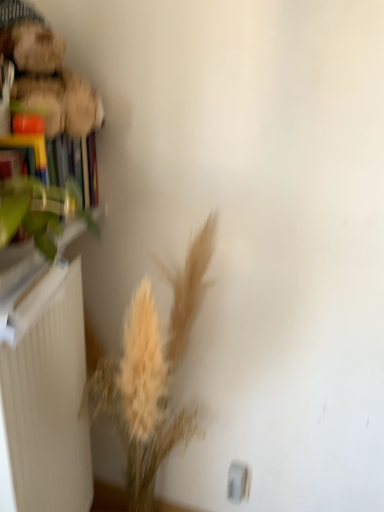
You are a GUI agent. You are given a task and a screenshot of the screen. Output one action in this format:
    pyautogui.click(x=<x>, y=<y>)
    Task: Click on the green leafy plant at left
    This screenshot has width=384, height=512.
    Given the screenshot: What is the action you would take?
    pyautogui.click(x=36, y=211)

Measure the distance between point (9, 140) and camera.

Point (9, 140) and camera are 37.01 inches apart from each other.

Find the location of a particular element. The width and height of the screenshot is (384, 512). green leafy plant at left is located at coordinates (36, 211).

Is white matte radiator at left oriented away from green leafy plant at left?

No, green leafy plant at left is not at the back of white matte radiator at left.

Is white matte radiator at left completely or partially outside of green leafy plant at left?

That's correct, white matte radiator at left is outside of green leafy plant at left.

Locate an element on the screen. plant behind the white matte radiator at left is located at coordinates (36, 211).

From the picture: Based on their sizes in the image, would you say white matte radiator at left is bigger or smaller than green leafy plant at left?

white matte radiator at left is bigger than green leafy plant at left.

Is green leafy plant at left facing away from light beige dried grass at lower left?

No, green leafy plant at left is not facing away from light beige dried grass at lower left.

From the image's perspective, is green leafy plant at left above or below light beige dried grass at lower left?

Based on their image positions, green leafy plant at left is located above light beige dried grass at lower left.

Considering the relative sizes of green leafy plant at left and light beige dried grass at lower left in the image provided, is green leafy plant at left smaller than light beige dried grass at lower left?

Indeed, green leafy plant at left has a smaller size compared to light beige dried grass at lower left.

Between green leafy plant at left and light beige dried grass at lower left, which one appears on the right side from the viewer's perspective?

light beige dried grass at lower left is more to the right.

Considering the sizes of objects hardcover book at left and green leafy plant at left in the image provided, who is bigger, hardcover book at left or green leafy plant at left?

hardcover book at left is bigger.

From the image's perspective, is hardcover book at left above or below green leafy plant at left?

hardcover book at left is above green leafy plant at left.

Based on the photo, how much distance is there between hardcover book at left and green leafy plant at left?

hardcover book at left and green leafy plant at left are 10.26 inches apart from each other.

Is hardcover book at left at the back of light beige dried grass at lower left?

No, light beige dried grass at lower left is not facing away from hardcover book at left.

Are light beige dried grass at lower left and hardcover book at left making contact?

They are not placed beside each other.

Is light beige dried grass at lower left bigger than hardcover book at left?

Correct, light beige dried grass at lower left is larger in size than hardcover book at left.

Considering the sizes of objects light beige dried grass at lower left and hardcover book at left in the image provided, who is taller, light beige dried grass at lower left or hardcover book at left?

Standing taller between the two is light beige dried grass at lower left.

Which is in front, point (66, 162) or point (147, 333)?

The point (147, 333) is more forward.

From a real-world perspective, which is physically below, hardcover book at left or light beige dried grass at lower left?

light beige dried grass at lower left.

Considering the relative sizes of hardcover book at left and light beige dried grass at lower left in the image provided, is hardcover book at left shorter than light beige dried grass at lower left?

Yes, hardcover book at left is shorter than light beige dried grass at lower left.

Looking at this image, which of these two, green leafy plant at left or hardcover book at left, is bigger?

With larger size is hardcover book at left.

From the image's perspective, which is above, green leafy plant at left or hardcover book at left?

From the image's view, hardcover book at left is above.

Which object is positioned more to the left, green leafy plant at left or hardcover book at left?

Positioned to the left is green leafy plant at left.

Which object is wider, white matte radiator at left or hardcover book at left?

Wider between the two is white matte radiator at left.

Who is smaller, white matte radiator at left or hardcover book at left?

hardcover book at left is smaller.

From a real-world perspective, is white matte radiator at left under hardcover book at left?

Yes, from a real-world perspective, white matte radiator at left is beneath hardcover book at left.

How different are the orientations of white matte radiator at left and hardcover book at left in degrees?

The facing directions of white matte radiator at left and hardcover book at left are 1.16 degrees apart.

There is a white matte radiator at left. Where is `plant above it (from a real-world perspective)`? plant above it (from a real-world perspective) is located at coordinates (36, 211).

You are a GUI agent. You are given a task and a screenshot of the screen. Output one action in this format:
    pyautogui.click(x=<x>, y=<y>)
    Task: Click on the plant that is on the left side of light beige dried grass at lower left
    The image size is (384, 512).
    Given the screenshot: What is the action you would take?
    pyautogui.click(x=36, y=211)

From the image, which object appears to be nearer to white matte radiator at left, green leafy plant at left or hardcover book at left?

The object closer to white matte radiator at left is green leafy plant at left.

When comparing their distances from white matte radiator at left, does light beige dried grass at lower left or hardcover book at left seem further?

hardcover book at left is positioned further to the anchor white matte radiator at left.

Looking at the image, which one is located closer to green leafy plant at left, light beige dried grass at lower left or hardcover book at left?

hardcover book at left lies closer to green leafy plant at left than the other object.

Based on their spatial positions, is green leafy plant at left or hardcover book at left further from light beige dried grass at lower left?

hardcover book at left.

Looking at the image, which one is located further to green leafy plant at left, white matte radiator at left or light beige dried grass at lower left?

Based on the image, light beige dried grass at lower left appears to be further to green leafy plant at left.

When comparing their distances from light beige dried grass at lower left, does white matte radiator at left or green leafy plant at left seem closer?

white matte radiator at left.

When comparing their distances from hardcover book at left, does green leafy plant at left or white matte radiator at left seem closer?

green leafy plant at left is closer to hardcover book at left.

From the image, which object appears to be farther from light beige dried grass at lower left, hardcover book at left or white matte radiator at left?

hardcover book at left is further to light beige dried grass at lower left.

This screenshot has width=384, height=512. What are the coordinates of `floral arrangement between hardcover book at left and white matte radiator at left in the up-down direction` in the screenshot? It's located at (150, 374).

Locate an element on the screen. The image size is (384, 512). plant between hardcover book at left and white matte radiator at left in the up-down direction is located at coordinates (36, 211).

Image resolution: width=384 pixels, height=512 pixels. In order to click on plant between hardcover book at left and light beige dried grass at lower left in the up-down direction in this screenshot , I will do `click(36, 211)`.

What are the coordinates of `floral arrangement between green leafy plant at left and white matte radiator at left in the up-down direction` in the screenshot? It's located at (150, 374).